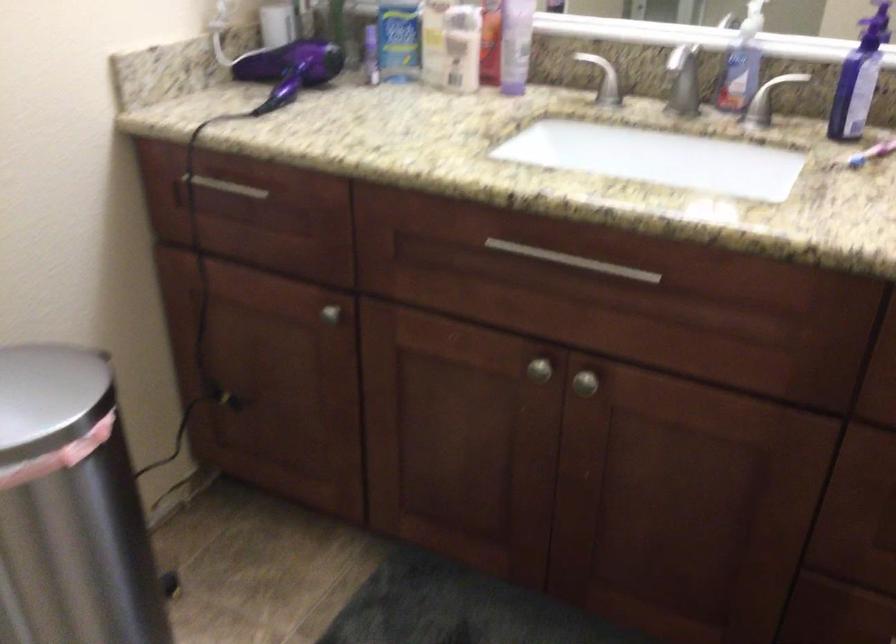
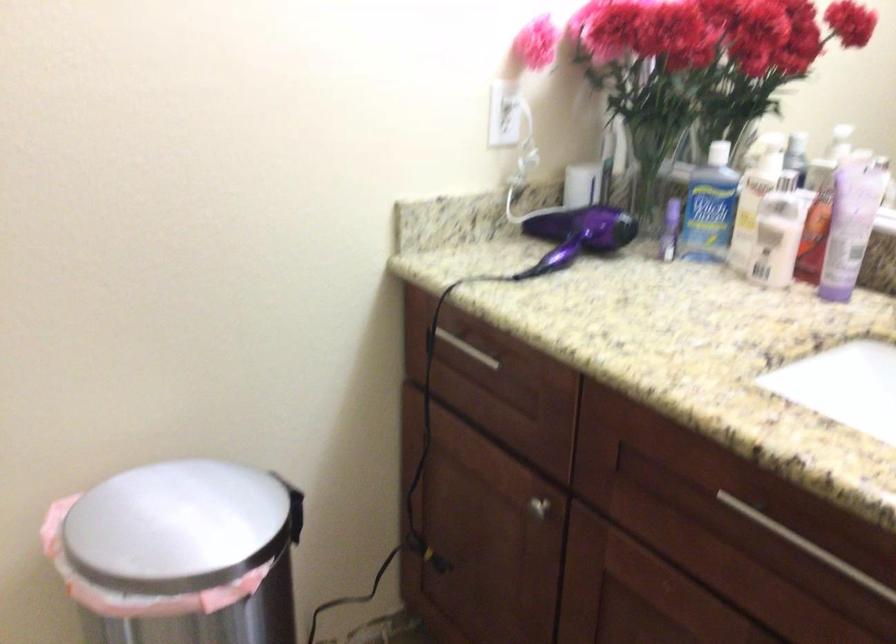
What movement of the cameraman would produce the second image?

The movement direction of the cameraman is right, forward.